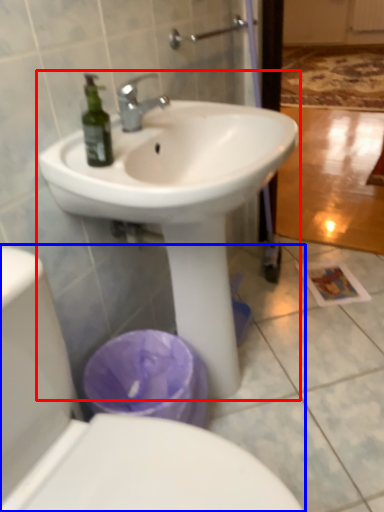
Question: Which object is closer to the camera taking this photo, sink (highlighted by a red box) or toilet (highlighted by a blue box)?

Choices:
 (A) sink
 (B) toilet

Answer: (B)